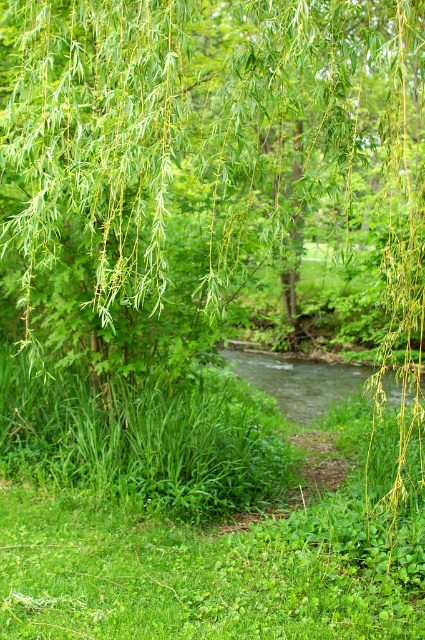
Looking at this image, what are the coordinates of the green leafy willow at upper center in the image?

The coordinates of the green leafy willow at upper center are at point (209, 157).

You are standing in the middle of the scene and want to walk towards the green leafy willow at upper center. Which direction should you move to get closer to it while avoiding the green leafy grass at center?

Since the green leafy willow at upper center is closer to the viewer than the green leafy grass at center, you should move forward towards the willow while stepping around or over the grass to reach it.